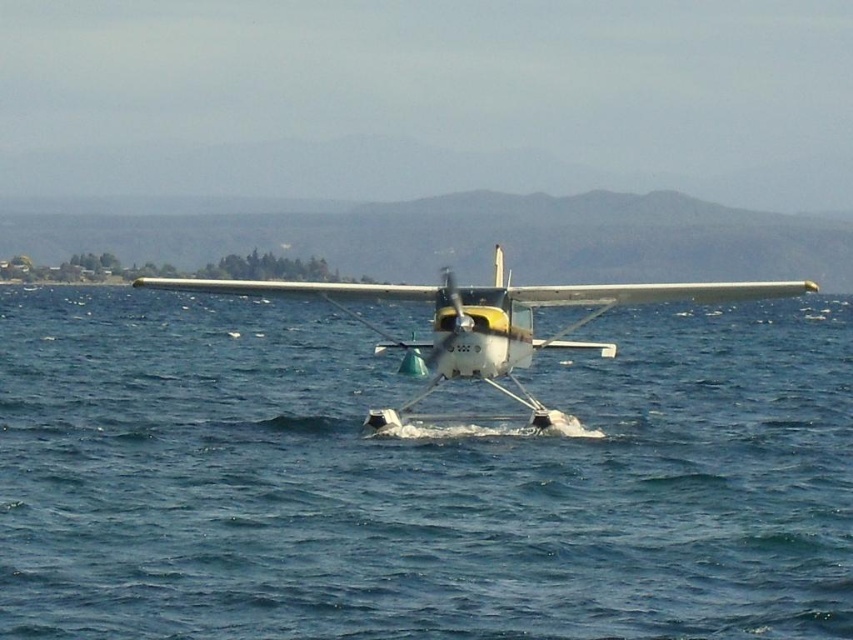
Does point (370, 540) come behind point (527, 356)?

No, it is in front of (527, 356).

Who is more distant from viewer, [846,369] or [492,292]?

The point [846,369] is behind.

Image resolution: width=853 pixels, height=640 pixels. I want to click on blue water at center, so click(x=416, y=477).